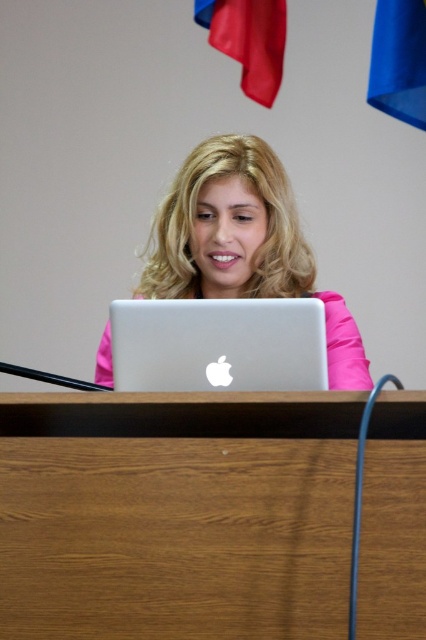
In the scene shown: You are a delivery person who needs to place a package on the wooden desk at center. However, there is a silver metallic laptop at center on the desk. Can you place the package on the desk without moving the laptop?

The wooden desk at center is below the silver metallic laptop at center, meaning the laptop is on top of the desk. Since the laptop is already on the desk, you can place the package on the desk next to the laptop without moving it.